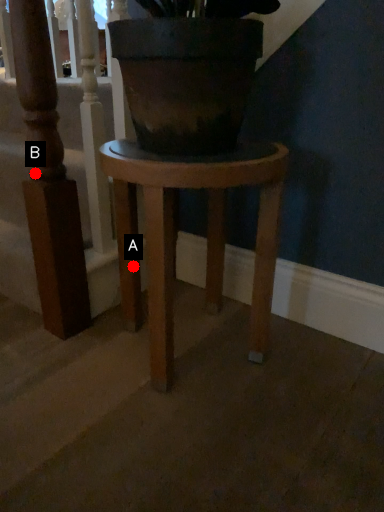
Question: Two points are circled on the image, labeled by A and B beside each circle. Which point is farther to the camera?

Choices:
 (A) A is further
 (B) B is further

Answer: (A)